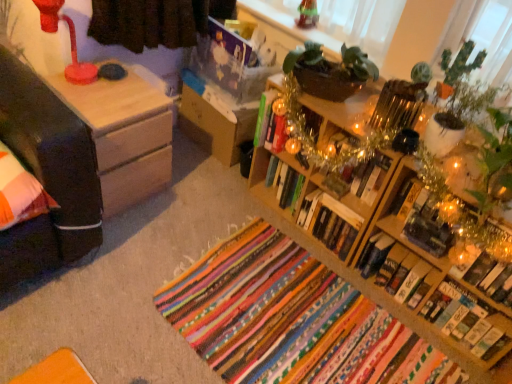
What are the coordinates of `empty space that is in between wooden nightstand at left and hardcover book at center, positioned as the 1th book in right-to-left order` in the screenshot? It's located at (250, 245).